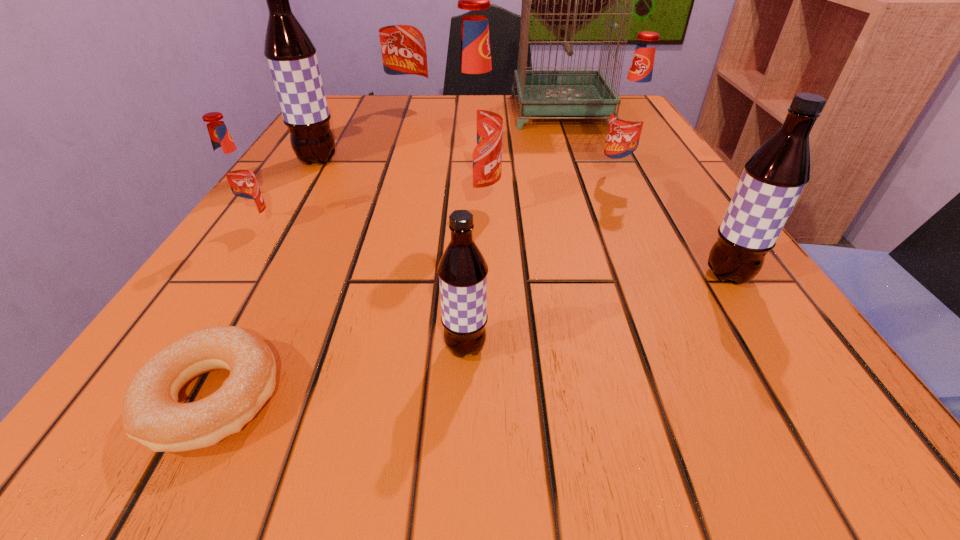
Where is `the rightmost root beer`? The width and height of the screenshot is (960, 540). the rightmost root beer is located at coordinates (773, 178).

Find the location of a particular element. This screenshot has width=960, height=540. the leftmost red root beer is located at coordinates (236, 179).

The image size is (960, 540). I want to click on the smallest brown root beer, so click(462, 270).

At what (x,y) coordinates should I click in order to perform the action: click on the second brown root beer from left to right. Please return your answer as a coordinate pair (x, y). The height and width of the screenshot is (540, 960). Looking at the image, I should click on (462, 270).

I want to click on bagel, so click(152, 415).

The height and width of the screenshot is (540, 960). Identify the location of tan bagel. (152, 415).

Image resolution: width=960 pixels, height=540 pixels. I want to click on vacant space located 0.230m at the door of the tallest object, so click(x=418, y=111).

Find the location of a particular element. The height and width of the screenshot is (540, 960). free space located at the door of the tallest object is located at coordinates (489, 111).

Where is `free spot located 0.250m at the door of the tallest object`? free spot located 0.250m at the door of the tallest object is located at coordinates pos(409,111).

This screenshot has height=540, width=960. I want to click on vacant space located 0.360m on the front of the farthest red root beer, so click(381, 203).